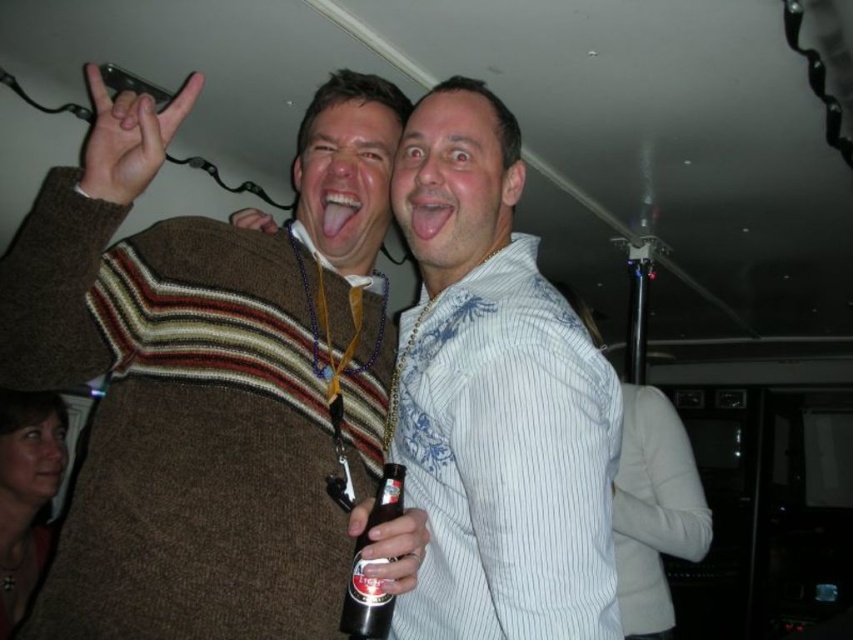
You are at a party and want to find the knitted sweater at center. The coordinates given are point [209,378]. Can you describe where exactly this point is located in relation to the two people?

The point [209,378] marks the knitted sweater at center, which is located between the two individuals in the scene.

Where is the knitted sweater at center located in the image?

The knitted sweater at center is located at point (209, 378) in the image.